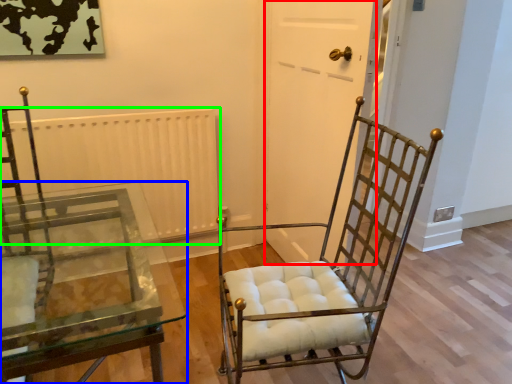
Question: Based on their relative distances, which object is nearer to glass door (highlighted by a red box)? Choose from table (highlighted by a blue box) and radiator (highlighted by a green box).

Choices:
 (A) table
 (B) radiator

Answer: (B)